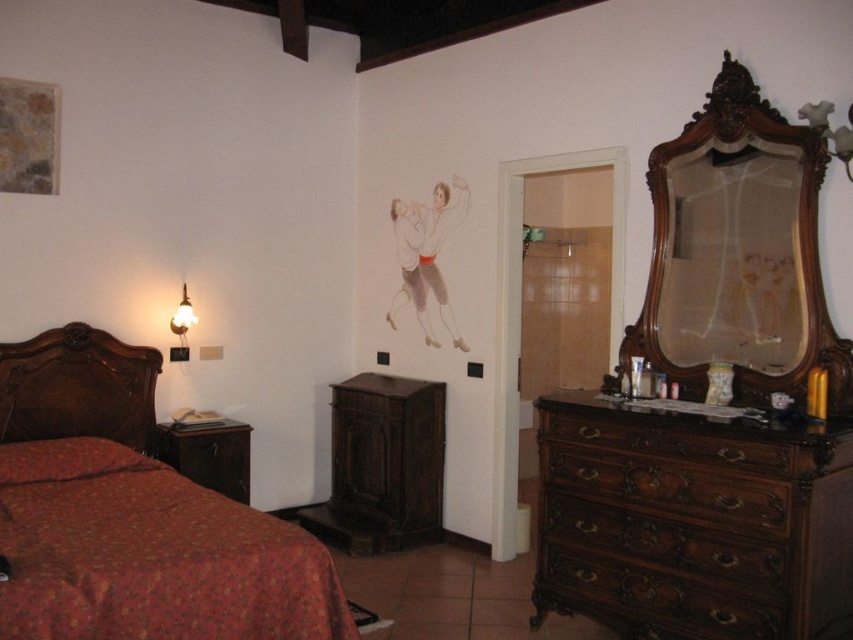
Question: Which of the following is the farthest from the observer?

Choices:
 (A) matte wood headboard at left
 (B) dark brown wood cabinet at center
 (C) red floral fabric bed at left
 (D) brown wood drawer at right

Answer: (B)

Question: Is brown wood drawer at right bigger than brown wood nightstand at lower left?

Choices:
 (A) no
 (B) yes

Answer: (B)

Question: Is dark brown wood cabinet at center to the left of matte gold lampshade at left from the viewer's perspective?

Choices:
 (A) yes
 (B) no

Answer: (B)

Question: Is brown wood drawer at right to the left of brown wood nightstand at lower left from the viewer's perspective?

Choices:
 (A) yes
 (B) no

Answer: (B)

Question: Among these objects, which one is nearest to the camera?

Choices:
 (A) matte gold lampshade at left
 (B) brown wood drawer at right
 (C) wooden mirror at right
 (D) dark brown wood dresser at right

Answer: (D)

Question: Which object is closer to the camera taking this photo?

Choices:
 (A) brown wood drawer at right
 (B) dark brown wood cabinet at center
 (C) matte gold lampshade at left

Answer: (A)